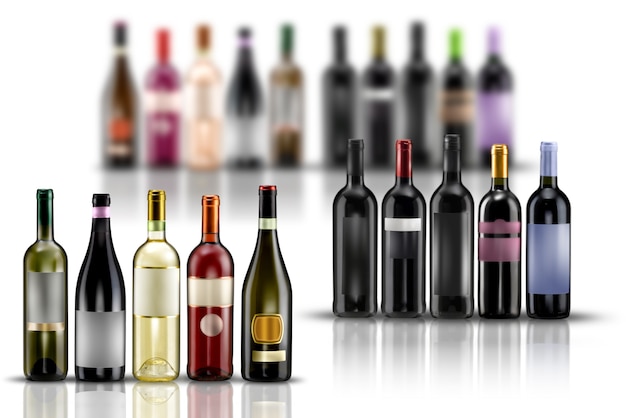
Where is `row of wine bottles left side adjusted`? The height and width of the screenshot is (418, 626). row of wine bottles left side adjusted is located at coordinates (43, 304), (88, 308), (151, 302), (203, 304), (259, 308).